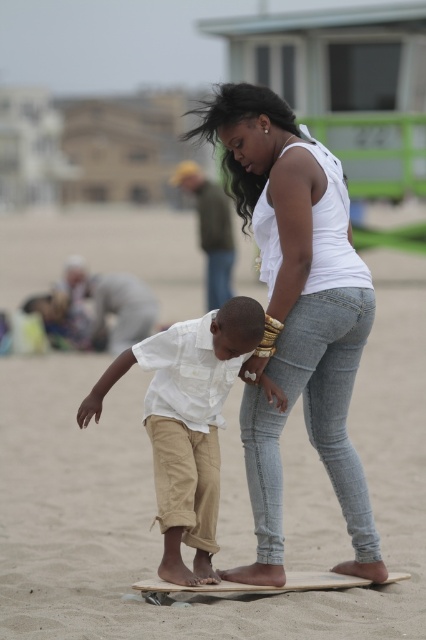
You are a photographer trying to capture a photo of the smooth wooden surfboard at center and the wooden skateboard at center. Since you want to focus on both objects equally, which one should you zoom in on more to ensure both are in focus?

The smooth wooden surfboard at center is much taller than the wooden skateboard at center, so you should zoom in more on the wooden skateboard at center to balance their sizes in the photo.

You are a photographer trying to capture the scene of the woman and boy on the wooden plank. Based on the image description, which object is positioned higher in the frame between the white denim jeans at center and the wooden skateboard at center?

The white denim jeans at center is much taller than the wooden skateboard at center, so it is positioned higher in the frame.